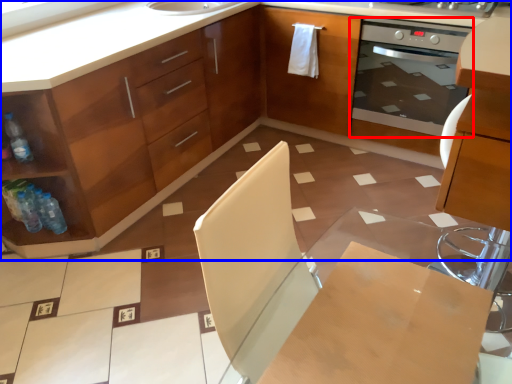
Question: Which object appears closest to the camera in this image, home appliance (highlighted by a red box) or cabinetry (highlighted by a blue box)?

Choices:
 (A) home appliance
 (B) cabinetry

Answer: (B)